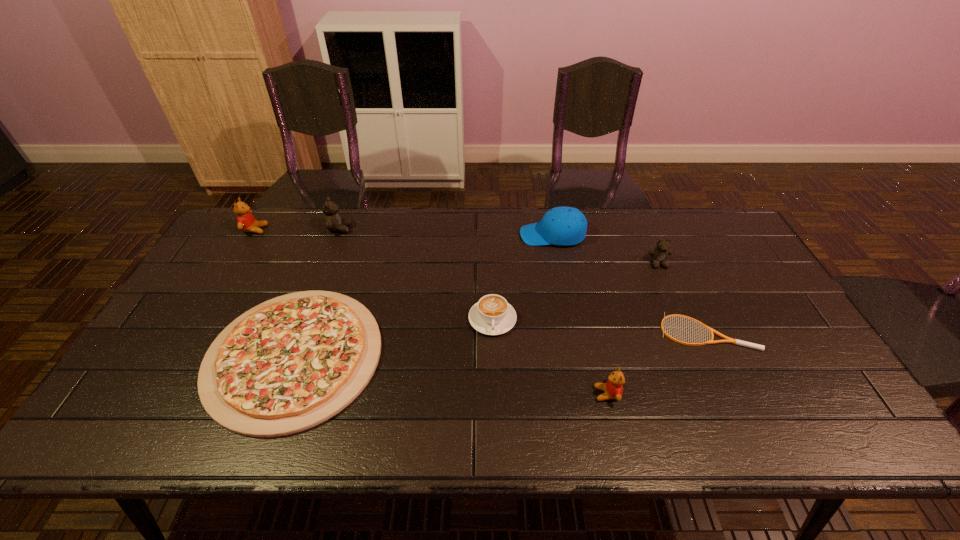
Identify the location of object that is at the right edge. (728, 340).

In order to click on object that is at the far left corner in this screenshot , I will do `click(246, 222)`.

Where is `object at the near left corner`? object at the near left corner is located at coordinates (293, 362).

Locate an element on the screen. The height and width of the screenshot is (540, 960). free space at the far edge of the desktop is located at coordinates (459, 231).

Where is `vacant area at the near edge`? The width and height of the screenshot is (960, 540). vacant area at the near edge is located at coordinates (234, 441).

At what (x,y) coordinates should I click in order to perform the action: click on free point at the left edge. Please return your answer as a coordinate pair (x, y). Looking at the image, I should click on (204, 318).

Find the location of `free space at the right edge of the desktop`. free space at the right edge of the desktop is located at coordinates (711, 260).

Where is `free space between the left red teddy bear and the beige tennis racket`? This screenshot has width=960, height=540. free space between the left red teddy bear and the beige tennis racket is located at coordinates (481, 281).

Locate an element on the screen. empty location between the nearest teddy bear and the tennis racket is located at coordinates (657, 363).

The height and width of the screenshot is (540, 960). I want to click on unoccupied position between the farther red teddy bear and the bigger brown teddy bear, so click(298, 230).